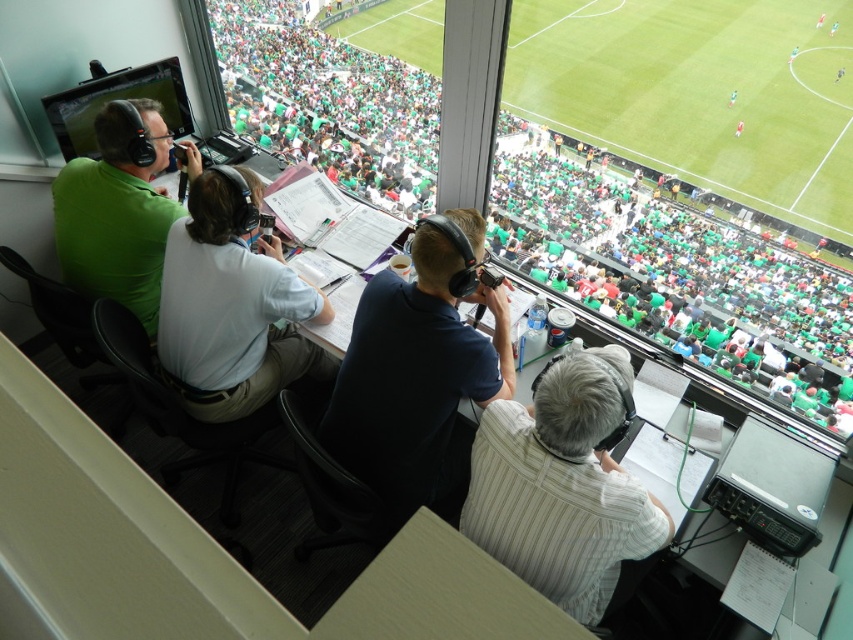
Can you confirm if dark blue shirt at center is taller than green matte shirt at upper left?

Yes.

Find the location of `dark blue shirt at center`. dark blue shirt at center is located at coordinates (416, 364).

Is dark blue shirt at center positioned before white cotton shirt at center?

Yes.

Does dark blue shirt at center have a greater height compared to white cotton shirt at center?

Yes, dark blue shirt at center is taller than white cotton shirt at center.

What do you see at coordinates (416, 364) in the screenshot? This screenshot has height=640, width=853. I see `dark blue shirt at center` at bounding box center [416, 364].

The image size is (853, 640). In order to click on dark blue shirt at center in this screenshot , I will do `click(416, 364)`.

Based on the photo, can you confirm if white cotton shirt at center is thinner than green matte shirt at upper left?

Incorrect, white cotton shirt at center's width is not less than green matte shirt at upper left's.

What do you see at coordinates (231, 310) in the screenshot? I see `white cotton shirt at center` at bounding box center [231, 310].

Find the location of a particular element. The height and width of the screenshot is (640, 853). white cotton shirt at center is located at coordinates (231, 310).